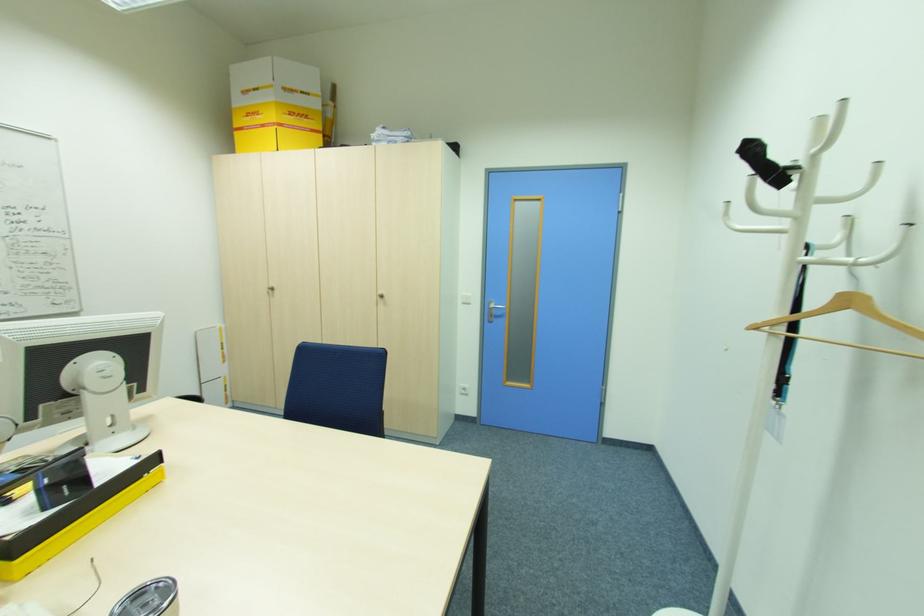
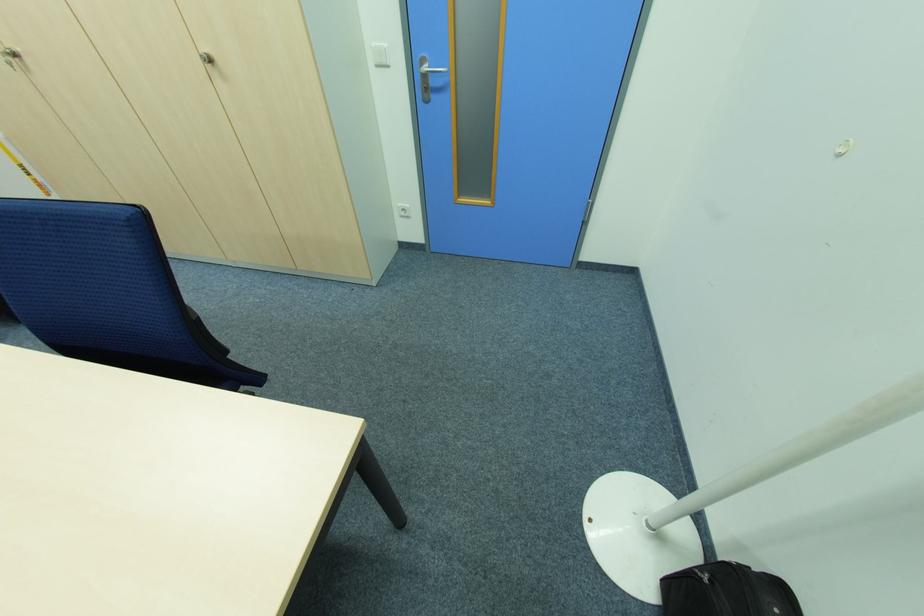
The point at (467, 389) is marked in the first image. Where is the corresponding point in the second image?

(407, 209)